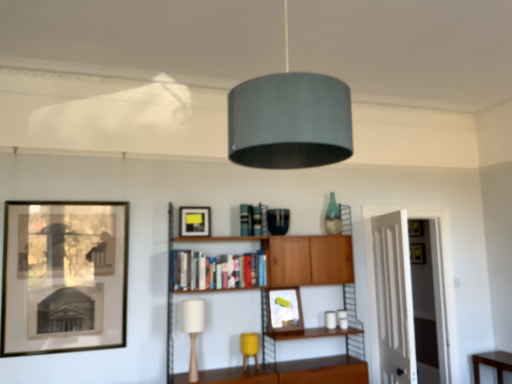
Question: Are white wood door at right and yellow fabric table lamp at lower center, the 2th table lamp positioned from the front, far apart?

Choices:
 (A) no
 (B) yes

Answer: (B)

Question: Considering the relative sizes of white wood door at right and yellow fabric table lamp at lower center, the 1th table lamp from the right, in the image provided, is white wood door at right shorter than yellow fabric table lamp at lower center, the 1th table lamp from the right,?

Choices:
 (A) yes
 (B) no

Answer: (B)

Question: Is white wood door at right bigger than yellow fabric table lamp at lower center, the 1th table lamp from the right?

Choices:
 (A) yes
 (B) no

Answer: (A)

Question: Is yellow fabric table lamp at lower center, the 1th table lamp from the right, at the back of white wood door at right?

Choices:
 (A) yes
 (B) no

Answer: (B)

Question: Is white wood door at right positioned behind yellow fabric table lamp at lower center, the 1th table lamp from the right?

Choices:
 (A) yes
 (B) no

Answer: (A)

Question: Considering the positions of white matte table lamp at center, the second table lamp in the back-to-front sequence, and wooden cabinet at center in the image, is white matte table lamp at center, the second table lamp in the back-to-front sequence, taller or shorter than wooden cabinet at center?

Choices:
 (A) tall
 (B) short

Answer: (B)

Question: Does point (190, 311) appear closer or farther from the camera than point (332, 258)?

Choices:
 (A) closer
 (B) farther

Answer: (A)

Question: Is white matte table lamp at center, which is the second table lamp from right to left, situated inside wooden cabinet at center or outside?

Choices:
 (A) outside
 (B) inside

Answer: (B)

Question: Is white matte table lamp at center, marked as the first table lamp in a front-to-back arrangement, wider or thinner than wooden cabinet at center?

Choices:
 (A) wide
 (B) thin

Answer: (B)

Question: Considering the positions of wooden cabinet at center and matte silver picture frame at center, positioned as the 1th picture frame in right-to-left order, in the image, is wooden cabinet at center bigger or smaller than matte silver picture frame at center, positioned as the 1th picture frame in right-to-left order,?

Choices:
 (A) small
 (B) big

Answer: (B)

Question: Does point (336, 332) appear closer or farther from the camera than point (295, 327)?

Choices:
 (A) closer
 (B) farther

Answer: (A)

Question: Is wooden cabinet at center in front of or behind matte silver picture frame at center, positioned as the 1th picture frame in right-to-left order, in the image?

Choices:
 (A) behind
 (B) front

Answer: (B)

Question: Is wooden cabinet at center to the left or to the right of matte silver picture frame at center, arranged as the 3th picture frame when viewed from the front, in the image?

Choices:
 (A) left
 (B) right

Answer: (A)

Question: Considering their positions, is yellow fabric table lamp at lower center, the 1th table lamp viewed from the back, located in front of or behind matte black picture frame at left, which is the 1th picture frame from left to right?

Choices:
 (A) behind
 (B) front

Answer: (A)

Question: Do you think yellow fabric table lamp at lower center, the 1th table lamp viewed from the back, is within matte black picture frame at left, which ranks as the 1th picture frame in front-to-back order, or outside of it?

Choices:
 (A) outside
 (B) inside

Answer: (A)